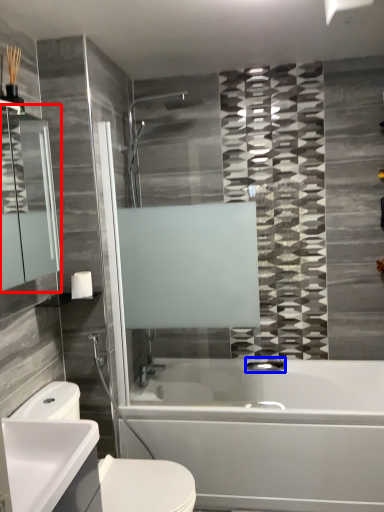
Question: Which of the following is the closest to the observer, mirror (highlighted by a red box) or plumbing fixture (highlighted by a blue box)?

Choices:
 (A) mirror
 (B) plumbing fixture

Answer: (A)